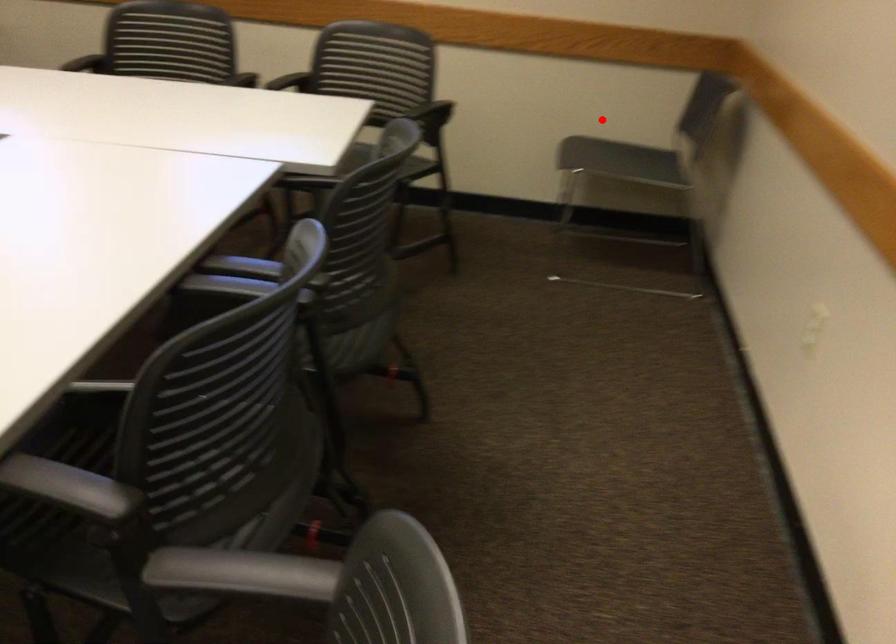
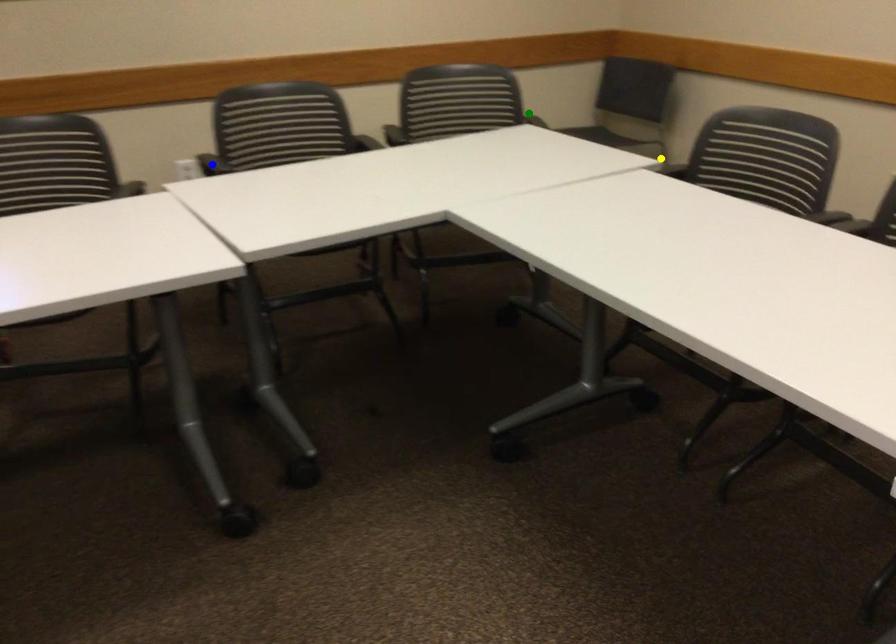
Question: I am providing you with two images of the same scene from different viewpoints. A red point is marked on the first image. You are given multiple points on the second image. Which point in image 2 is actually the same real-world point as the red point in image 1?

Choices:
 (A) green point
 (B) yellow point
 (C) blue point

Answer: (A)